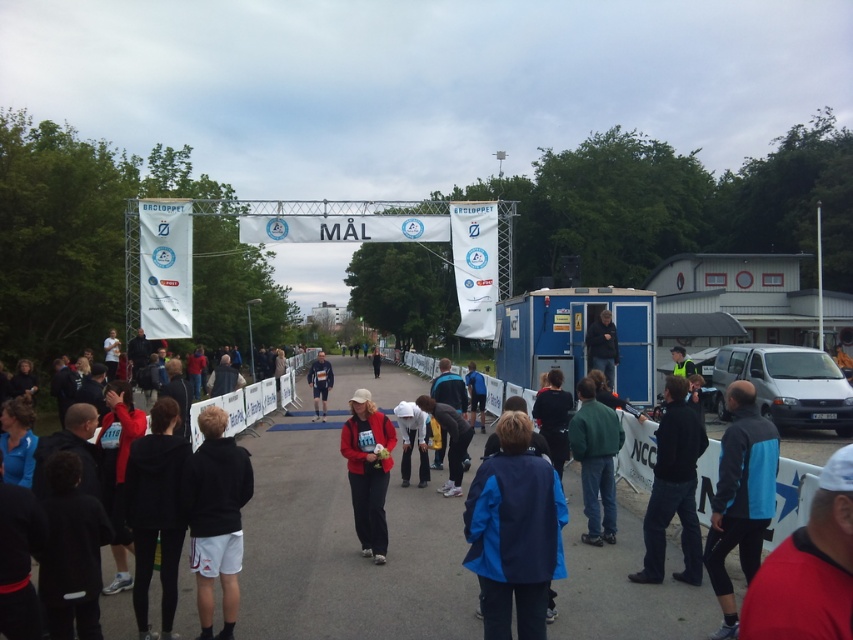
Question: Which is farther from the matte black shorts at center?

Choices:
 (A) green matte jacket at center
 (B) blue fabric jacket at center

Answer: (B)

Question: Where is red matte cap at upper right located in relation to black hoodie at center in the image?

Choices:
 (A) left
 (B) right

Answer: (B)

Question: Does black fabric jacket at left have a smaller size compared to green matte jacket at center?

Choices:
 (A) no
 (B) yes

Answer: (A)

Question: Which object is positioned farthest from the black fabric jacket at left?

Choices:
 (A) dark blue jacket at center
 (B) blue fabric jacket at center
 (C) matte black shorts at center
 (D) red matte cap at upper right

Answer: (D)

Question: Where is black hoodie at center located in relation to matte red jacket at center in the image?

Choices:
 (A) left
 (B) right

Answer: (A)

Question: Estimate the real-world distances between objects in this image. Which object is farther from the black hoodie at center?

Choices:
 (A) dark blue jacket at center
 (B) black fabric jacket at left

Answer: (A)